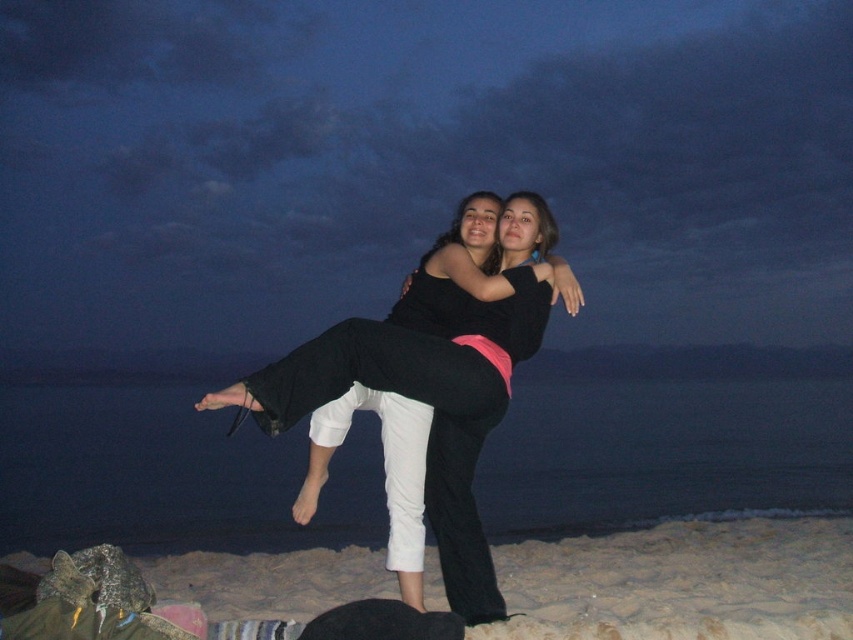
Question: Which object is farther from the camera taking this photo?

Choices:
 (A) black matte pants at center
 (B) sandy at lower center

Answer: (B)

Question: Which of the following is the closest to the observer?

Choices:
 (A) sandy at lower center
 (B) black matte pants at center

Answer: (B)

Question: Observing the image, what is the correct spatial positioning of sandy at lower center in reference to black matte pants at center?

Choices:
 (A) above
 (B) below

Answer: (B)

Question: Is sandy at lower center smaller than black matte pants at center?

Choices:
 (A) yes
 (B) no

Answer: (B)

Question: From the image, what is the correct spatial relationship of sandy at lower center in relation to black matte pants at center?

Choices:
 (A) right
 (B) left

Answer: (A)